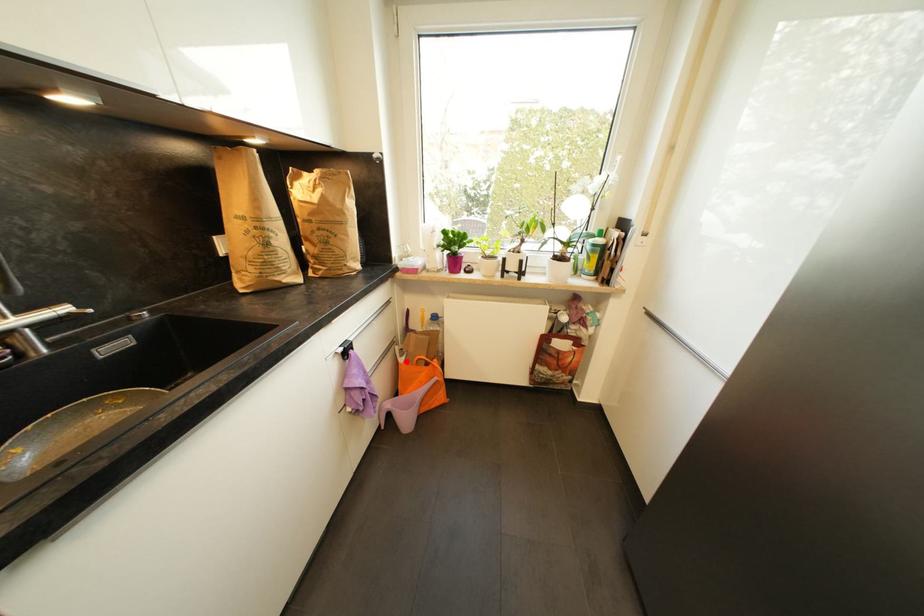
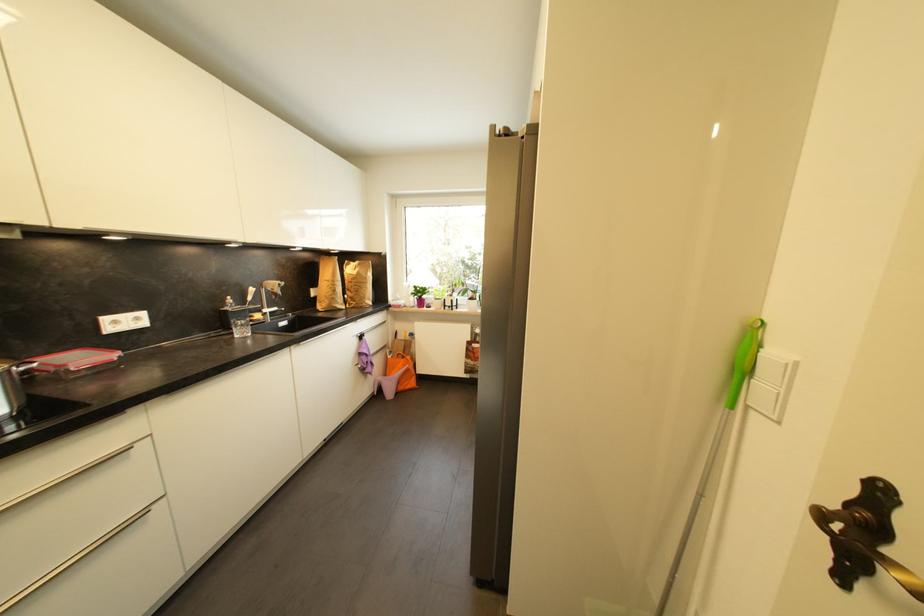
Question: A red point is marked in image1. In image2, is the corresponding 3D point closer to the camera or farther? Reply with the corresponding letter.

Choices:
 (A) The corresponding 3D point is closer.
 (B) The corresponding 3D point is farther.

Answer: (B)